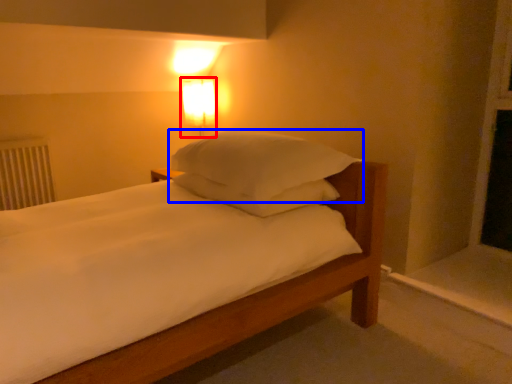
Question: Which point is further to the camera, bedside lamp (highlighted by a red box) or pillow (highlighted by a blue box)?

Choices:
 (A) bedside lamp
 (B) pillow

Answer: (A)